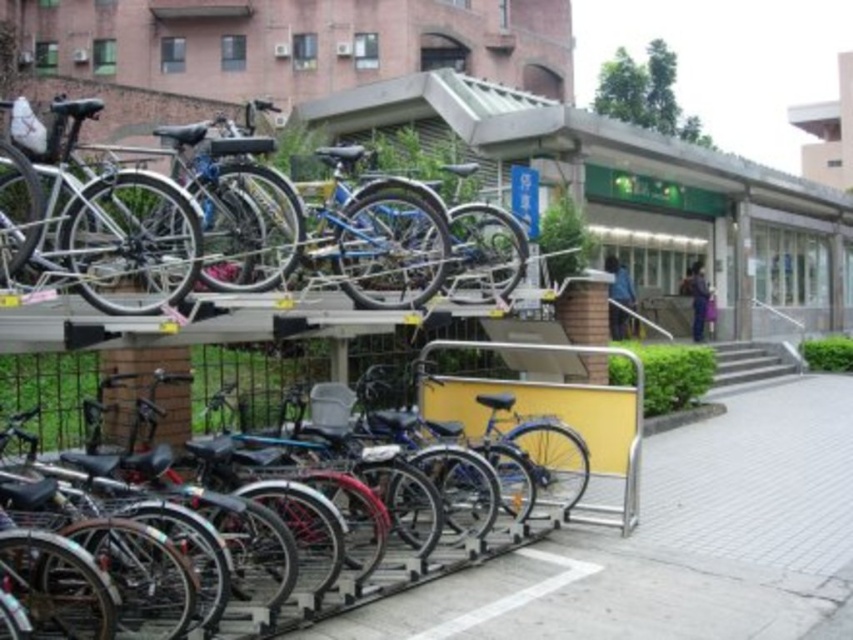
Is silver metallic bicycle at upper left shorter than metallic silver bicycle at center?

In fact, silver metallic bicycle at upper left may be taller than metallic silver bicycle at center.

Does silver metallic bicycle at upper left come behind metallic silver bicycle at center?

Yes, it is behind metallic silver bicycle at center.

Who is more distant from viewer, (258, 102) or (410, 561)?

The point (258, 102) is more distant.

Locate an element on the screen. This screenshot has width=853, height=640. silver metallic bicycle at upper left is located at coordinates (351, 227).